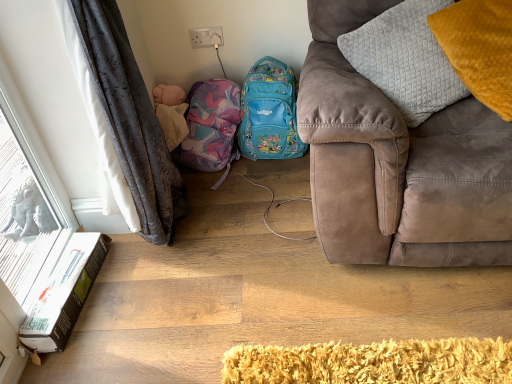
Question: Considering the positions of yellow velvet pillow at upper right, acting as the second pillow starting from the left, and matte purple backpack at center in the image, is yellow velvet pillow at upper right, acting as the second pillow starting from the left, wider or thinner than matte purple backpack at center?

Choices:
 (A) thin
 (B) wide

Answer: (A)

Question: Considering the positions of yellow velvet pillow at upper right, acting as the second pillow starting from the left, and matte purple backpack at center in the image, is yellow velvet pillow at upper right, acting as the second pillow starting from the left, taller or shorter than matte purple backpack at center?

Choices:
 (A) tall
 (B) short

Answer: (A)

Question: Estimate the real-world distances between objects in this image. Which object is farther from the white frosted glass at left?

Choices:
 (A) matte blue backpack at center
 (B) suede couch at right
 (C) matte purple backpack at center
 (D) yellow velvet pillow at upper right, acting as the second pillow starting from the left
 (E) quilted gray pillow at upper right, the first pillow positioned from the left

Answer: (D)

Question: Estimate the real-world distances between objects in this image. Which object is closer to the yellow velvet pillow at upper right, acting as the second pillow starting from the left?

Choices:
 (A) matte purple backpack at center
 (B) white frosted glass at left
 (C) white cardboard box at lower left
 (D) quilted gray pillow at upper right, the first pillow positioned from the left
 (E) suede couch at right

Answer: (D)